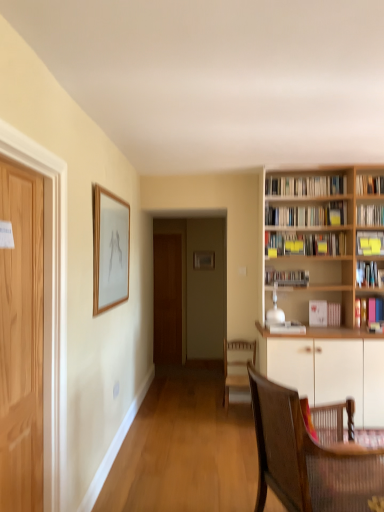
The width and height of the screenshot is (384, 512). What are the coordinates of `free space above matte black bookshelf at center, which is the 6th book from top to bottom (from a real-world perspective)` in the screenshot? It's located at (287, 264).